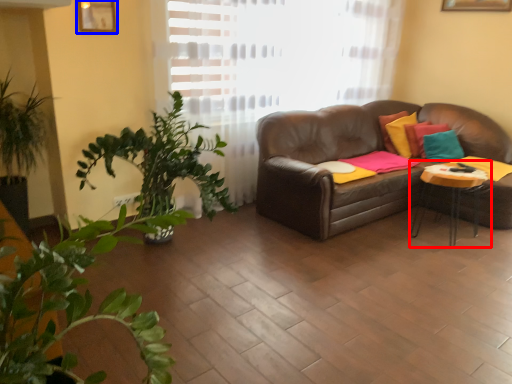
Question: Among these objects, which one is farthest to the camera, table (highlighted by a red box) or picture frame (highlighted by a blue box)?

Choices:
 (A) table
 (B) picture frame

Answer: (A)